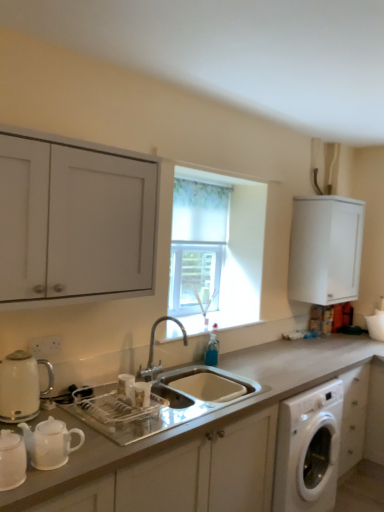
Question: Is matte white kettle at left positioned before silver metallic faucet at center?

Choices:
 (A) yes
 (B) no

Answer: (A)

Question: Can you confirm if matte white kettle at left is smaller than silver metallic faucet at center?

Choices:
 (A) no
 (B) yes

Answer: (B)

Question: Would you say silver metallic faucet at center is part of matte white kettle at left's contents?

Choices:
 (A) yes
 (B) no

Answer: (B)

Question: Can you confirm if matte white kettle at left is shorter than silver metallic faucet at center?

Choices:
 (A) no
 (B) yes

Answer: (B)

Question: Can you confirm if matte white kettle at left is thinner than silver metallic faucet at center?

Choices:
 (A) no
 (B) yes

Answer: (B)

Question: Is matte white kettle at left completely or partially outside of silver metallic faucet at center?

Choices:
 (A) no
 (B) yes

Answer: (B)

Question: Is white matte cabinet at upper right, which ranks as the 1th cabinetry in right-to-left order, wider than matte white kettle at left?

Choices:
 (A) yes
 (B) no

Answer: (A)

Question: Would you consider white matte cabinet at upper right, the first cabinetry from the back, to be distant from matte white kettle at left?

Choices:
 (A) yes
 (B) no

Answer: (A)

Question: Does white matte cabinet at upper right, the first cabinetry from the back, have a greater height compared to matte white kettle at left?

Choices:
 (A) yes
 (B) no

Answer: (A)

Question: From a real-world perspective, is white matte cabinet at upper right, which ranks as the 1th cabinetry in right-to-left order, beneath matte white kettle at left?

Choices:
 (A) yes
 (B) no

Answer: (B)

Question: Can we say white matte cabinet at upper right, the 2th cabinetry positioned from the front, lies outside matte white kettle at left?

Choices:
 (A) no
 (B) yes

Answer: (B)

Question: From the image's perspective, is white matte cabinet at upper right, the 2th cabinetry positioned from the front, beneath matte white kettle at left?

Choices:
 (A) yes
 (B) no

Answer: (B)

Question: Can you confirm if silver metallic faucet at center is taller than matte white kettle at left?

Choices:
 (A) yes
 (B) no

Answer: (A)